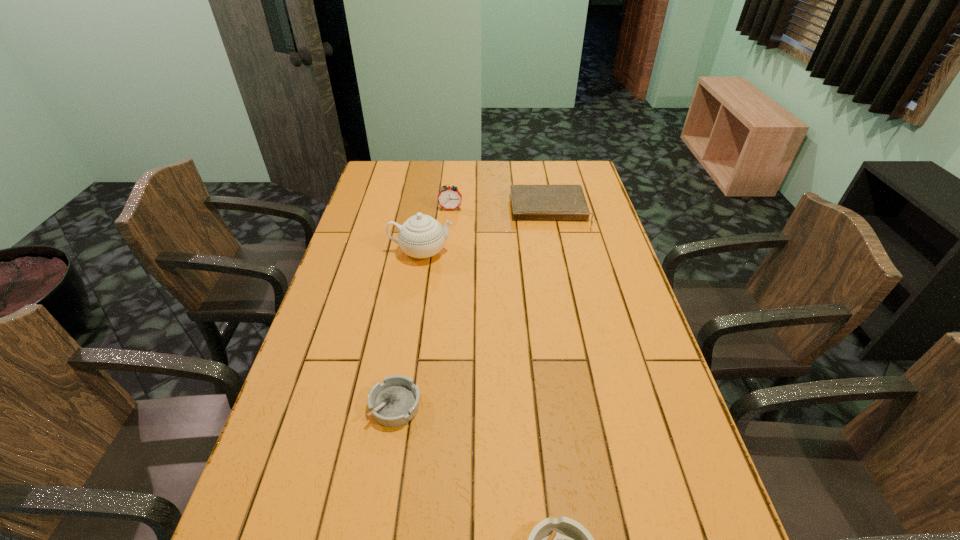
Find the location of `the third nearest object`. the third nearest object is located at coordinates (421, 236).

Where is `chinaware`? chinaware is located at coordinates (421, 236).

Identify the location of alarm clock. (449, 198).

What are the coordinates of `paperback book` in the screenshot? It's located at (529, 202).

This screenshot has height=540, width=960. I want to click on the farther ashtray, so click(x=394, y=402).

You are a GUI agent. You are given a task and a screenshot of the screen. Output one action in this format:
    pyautogui.click(x=<x>, y=<y>)
    Task: Click on the fourth farthest object
    This screenshot has width=960, height=540.
    Given the screenshot: What is the action you would take?
    pyautogui.click(x=394, y=402)

In order to click on vacant space located 0.150m on the spout of the third nearest object in this screenshot , I will do `click(498, 251)`.

Where is `blank area located 0.370m on the clock face of the alarm clock`? blank area located 0.370m on the clock face of the alarm clock is located at coordinates (444, 278).

Where is `vacant area situated 0.070m on the spine side of the paperback book`? vacant area situated 0.070m on the spine side of the paperback book is located at coordinates (557, 245).

Identify the location of vacant space situated on the back of the farther ashtray. The image size is (960, 540). (405, 342).